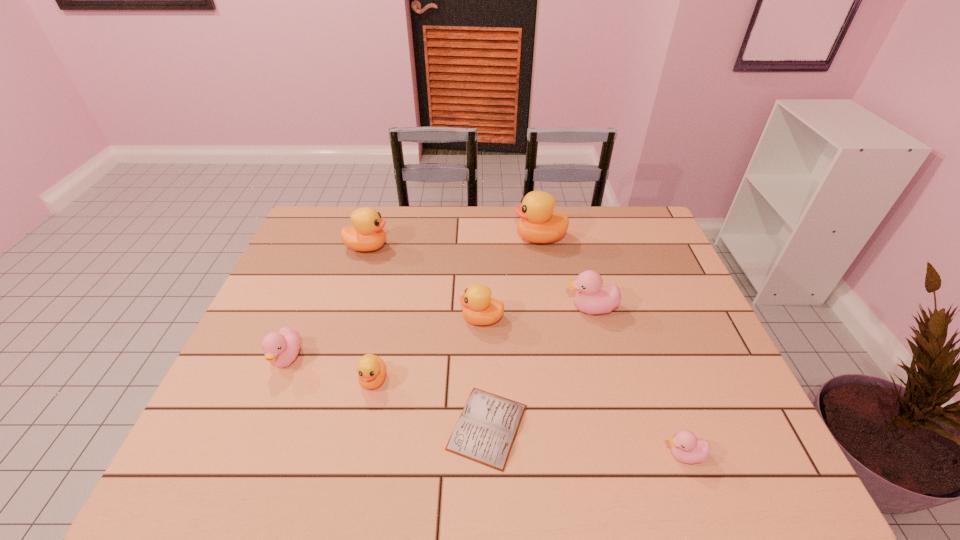
Locate an element on the screen. The height and width of the screenshot is (540, 960). free space that satisfies the following two spatial constraints: 1. on the face of the leftmost yellow duckling; 2. on the front-facing side of the leftmost duckling is located at coordinates (333, 359).

Where is `vacant space that satisfies the following two spatial constraints: 1. on the face of the rightmost yellow duckling; 2. on the front-facing side of the leftmost pink duckling`? vacant space that satisfies the following two spatial constraints: 1. on the face of the rightmost yellow duckling; 2. on the front-facing side of the leftmost pink duckling is located at coordinates (560, 359).

Locate an element on the screen. free location that satisfies the following two spatial constraints: 1. on the face of the nearest yellow duckling; 2. on the left side of the white diary is located at coordinates (363, 427).

Identify the location of vacant region that satisfies the following two spatial constraints: 1. on the face of the white diary; 2. on the right side of the second yellow duckling from left to right. This screenshot has width=960, height=540. (363, 427).

What are the coordinates of `vacant space that satisfies the following two spatial constraints: 1. on the front-facing side of the second smallest pink duckling; 2. on the right side of the diary` in the screenshot? It's located at (259, 427).